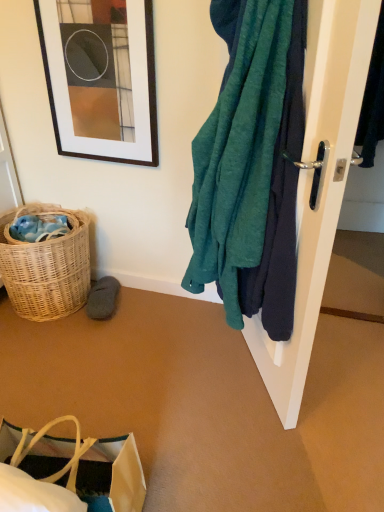
Question: Can you confirm if white glossy door handle at right is bigger than matte black picture frame at upper left?

Choices:
 (A) no
 (B) yes

Answer: (B)

Question: From a real-world perspective, is white glossy door handle at right on matte black picture frame at upper left?

Choices:
 (A) yes
 (B) no

Answer: (B)

Question: From the image's perspective, is white glossy door handle at right under matte black picture frame at upper left?

Choices:
 (A) yes
 (B) no

Answer: (A)

Question: Considering the relative sizes of white glossy door handle at right and matte black picture frame at upper left in the image provided, is white glossy door handle at right wider than matte black picture frame at upper left?

Choices:
 (A) no
 (B) yes

Answer: (B)

Question: Is white glossy door handle at right outside of matte black picture frame at upper left?

Choices:
 (A) no
 (B) yes

Answer: (B)

Question: Are white glossy door handle at right and matte black picture frame at upper left located far from each other?

Choices:
 (A) no
 (B) yes

Answer: (A)

Question: Is matte black picture frame at upper left next to teal fabric towel at right?

Choices:
 (A) no
 (B) yes

Answer: (A)

Question: Does matte black picture frame at upper left have a greater width compared to teal fabric towel at right?

Choices:
 (A) no
 (B) yes

Answer: (A)

Question: Is the position of matte black picture frame at upper left more distant than that of teal fabric towel at right?

Choices:
 (A) no
 (B) yes

Answer: (B)

Question: Considering the relative sizes of matte black picture frame at upper left and teal fabric towel at right in the image provided, is matte black picture frame at upper left thinner than teal fabric towel at right?

Choices:
 (A) yes
 (B) no

Answer: (A)

Question: From a real-world perspective, is matte black picture frame at upper left physically below teal fabric towel at right?

Choices:
 (A) yes
 (B) no

Answer: (B)

Question: Is matte black picture frame at upper left turned away from teal fabric towel at right?

Choices:
 (A) no
 (B) yes

Answer: (A)

Question: Is the surface of white glossy door handle at right in direct contact with brown paper bag at lower left?

Choices:
 (A) no
 (B) yes

Answer: (A)